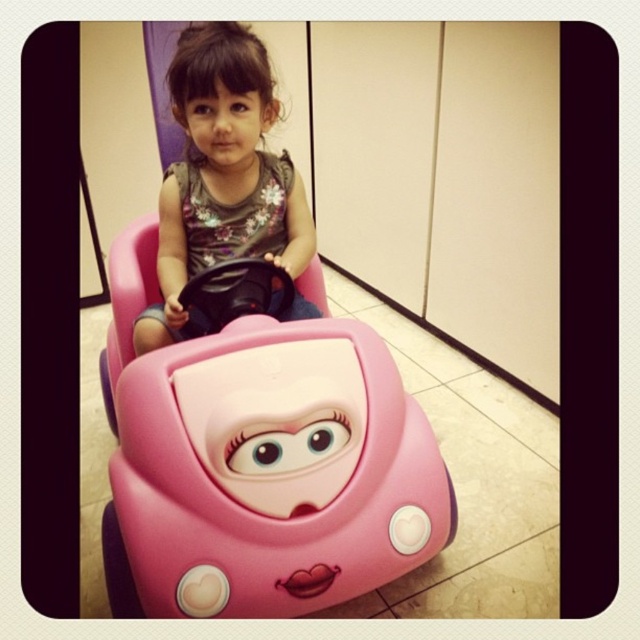
You are a parent trying to locate two points in the room where your child is playing. The first point is at coordinates point [141,280] and the second is at point [202,64]. According to the image, which point is closer to the child sitting in the pink toy car?

Point [202,64] is closer to the child sitting in the pink toy car because point [141,280] is behind it.

You are a parent looking at the image of your child playing with a toy car. The toy car is located at point (259, 464). Can you determine if the pink plastic toy car at center is exactly at that coordinate?

Yes, the pink plastic toy car at center is exactly at point (259, 464) as specified.

You are a parent trying to arrange two toy cars in a childproofed play area. The play area has a rule that all toys must be placed to the left of the entrance door. You have the pink plastic toy car at center and the matte pink toy car at center. Which toy car should you place closer to the entrance door?

You should place the matte pink toy car at center closer to the entrance door because the pink plastic toy car at center is to its right, so the matte pink toy car at center is on the left side.